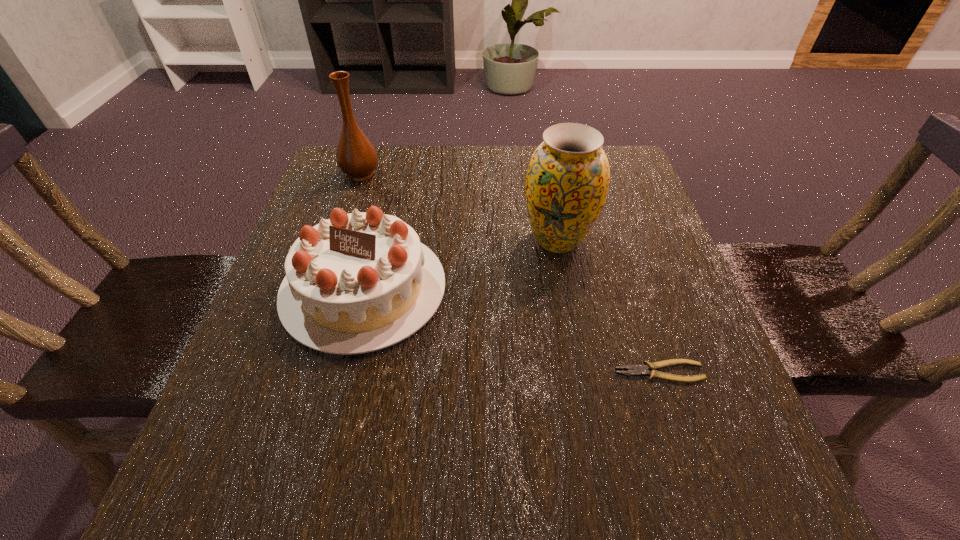
The width and height of the screenshot is (960, 540). What are the coordinates of `blank space at the far left corner` in the screenshot? It's located at (390, 145).

Locate an element on the screen. This screenshot has height=540, width=960. free spot between the right vase and the shortest object is located at coordinates (608, 306).

The height and width of the screenshot is (540, 960). I want to click on unoccupied area between the right vase and the farthest object, so click(x=459, y=207).

What are the coordinates of `free space between the nearest object and the nearer vase` in the screenshot? It's located at (608, 306).

Identify the location of free space between the second shortest object and the right vase. Image resolution: width=960 pixels, height=540 pixels. (461, 265).

What are the coordinates of `free space between the third tallest object and the pliers` in the screenshot? It's located at (512, 330).

The image size is (960, 540). Identify the location of free space between the farthest object and the nearest object. (510, 273).

The width and height of the screenshot is (960, 540). I want to click on free space that is in between the right vase and the farthest object, so click(x=459, y=207).

Where is `vacant space in between the nearest object and the birthday cake`? vacant space in between the nearest object and the birthday cake is located at coordinates (512, 330).

The image size is (960, 540). In order to click on unoccupied position between the right vase and the birthday cake in this screenshot , I will do `click(461, 265)`.